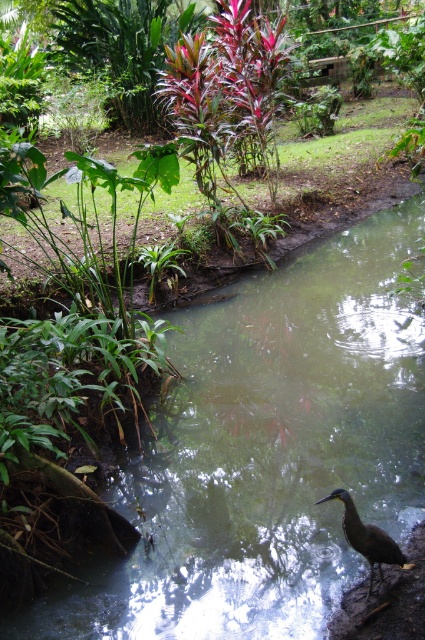
You are a photographer trying to capture the brown glossy bird at lower center without the greenish murky water at center obstructing the view. Is the bird positioned behind the water or in front of it?

The brown glossy bird at lower center is behind the greenish murky water at center, so the water will obstruct the view of the bird.

You are a photographer aiming to capture the brown glossy bird at lower center and the greenish murky water at center in a single shot. Based on their positions, which object is closer to the camera?

The brown glossy bird at lower center is closer to the camera because it is above the greenish murky water at center, which is positioned below it.

You are a photographer aiming to capture the brown glossy bird at lower center and the greenish murky water at center in your shot. Which object occupies more horizontal space in the image?

The greenish murky water at center has a greater width than the brown glossy bird at lower center, so it occupies more horizontal space in the image.